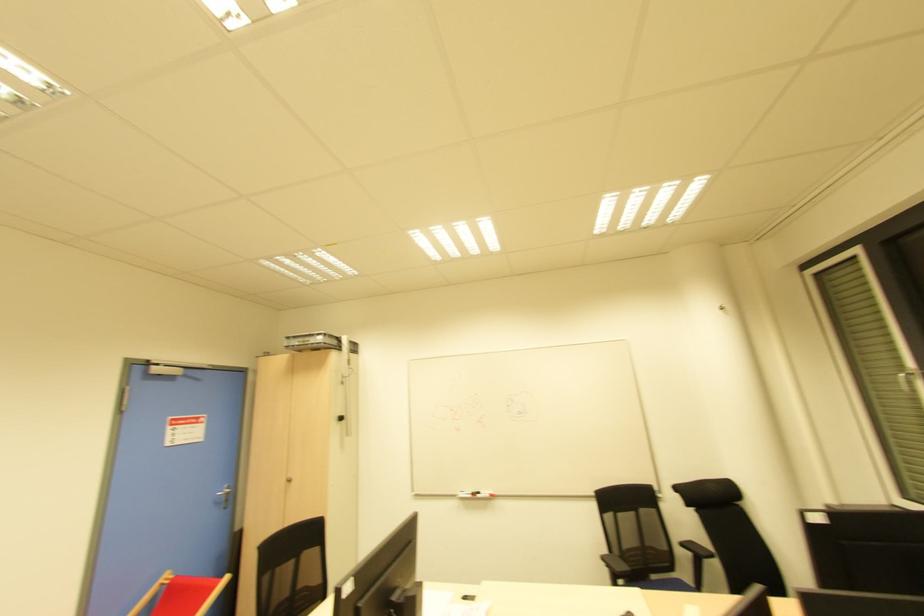
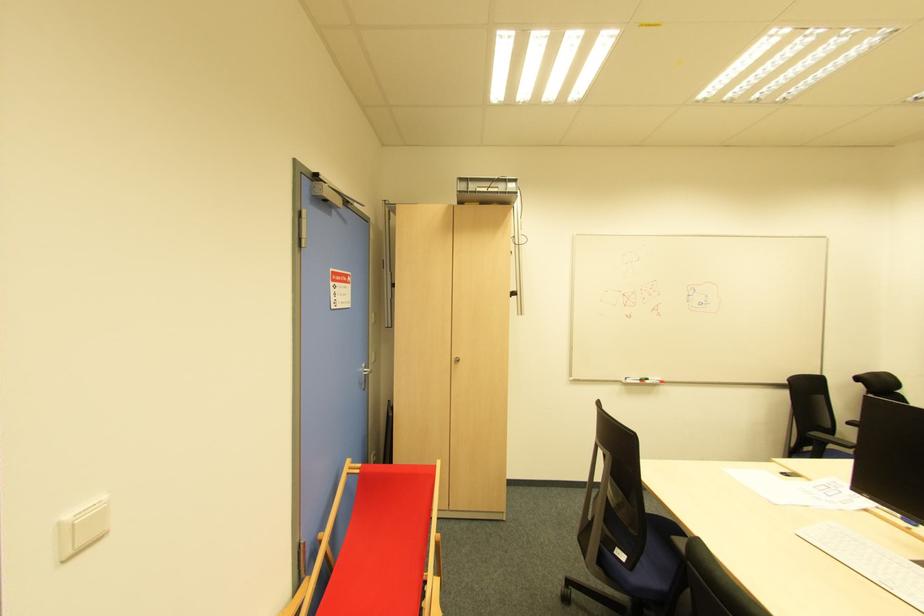
The point at [478,496] is marked in the first image. Where is the corresponding point in the second image?

(647, 383)